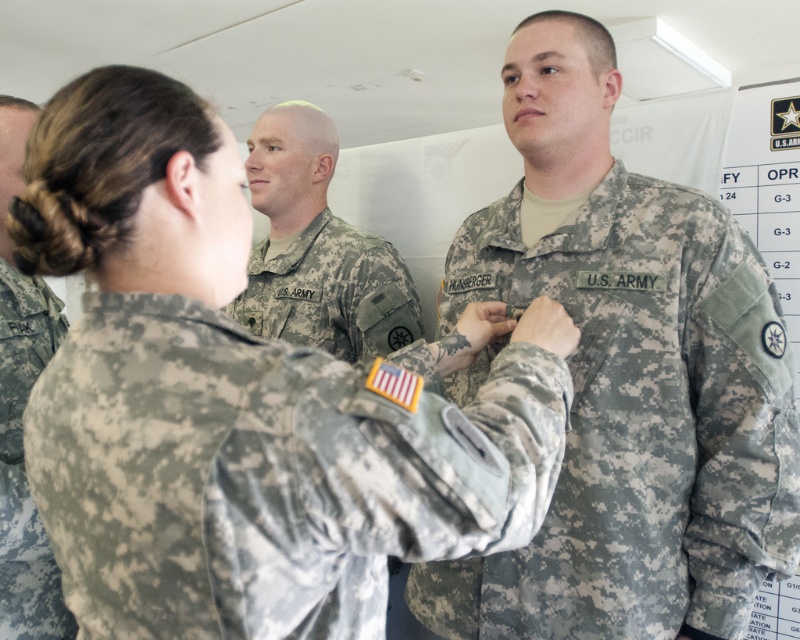
You are standing at the entrance of the tent and see two points marked in the scene. Which point is closer to you, point (x=358, y=552) or point (x=606, y=509)?

Point (x=358, y=552) is in front of point (x=606, y=509), so it is closer to you.

You are a photographer trying to capture a clear photo of the camouflage fabric at center and the camouflage uniform at center. Which object should you focus on first to ensure both are in focus?

The camouflage fabric at center is in front of the camouflage uniform at center. To ensure both are in focus, you should focus on the camouflage fabric at center first, as it is closer to the camera, and then the camouflage uniform at center will be in the background.